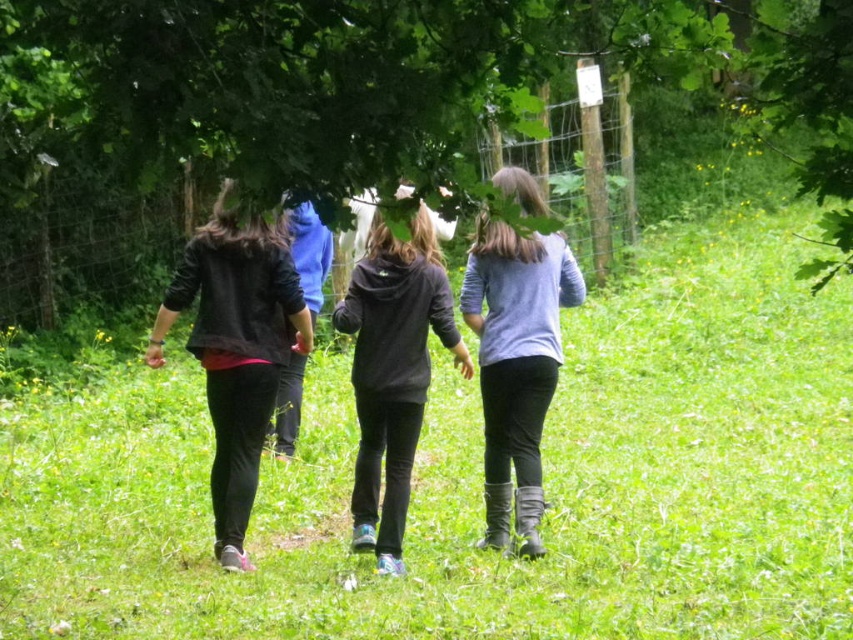
You are a photographer trying to capture a clear shot of the dark gray hoodie at center without the light blue fabric jacket at center blocking it. Based on their positions, is this possible?

The light blue fabric jacket at center is positioned over dark gray hoodie at center, so the dark gray hoodie at center is currently blocked by the light blue fabric jacket at center. To get a clear shot, you would need to adjust your angle or wait for them to move so the light blue fabric jacket at center is no longer in front.